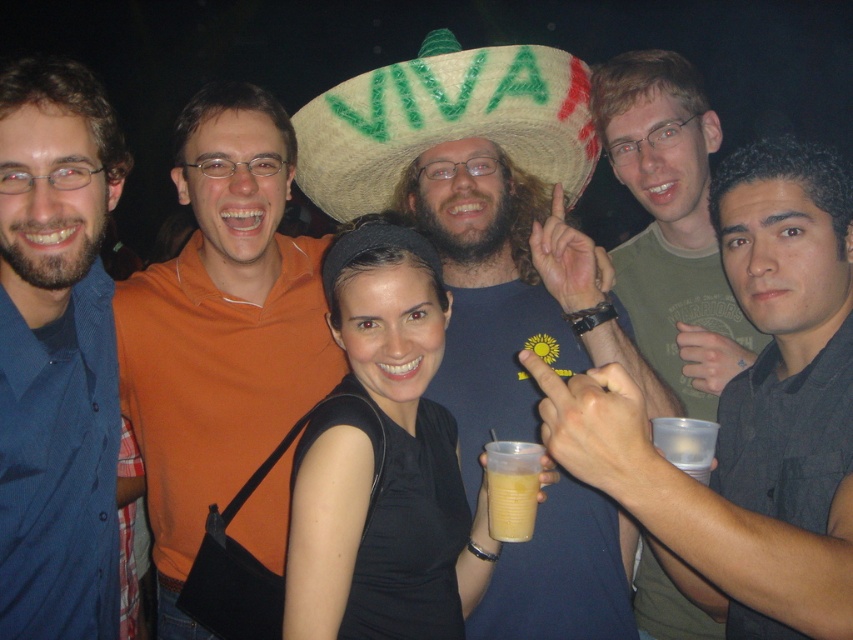
You are at a party and want to place the yellow translucent cup at center on top of the straw hat at center. Is this possible based on their sizes?

The straw hat at center has a greater height compared to the yellow translucent cup at center, so placing the cup on top of the hat is possible as the cup is shorter.

Consider the image. You are at a party and want to use the straw hat at center and the yellow translucent cup at center. Which object is bigger?

The straw hat at center is larger in size compared to the yellow translucent cup at center.